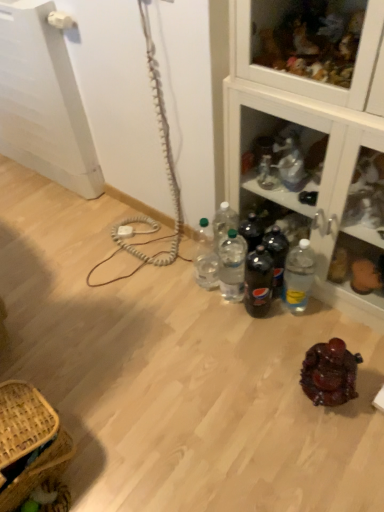
The image size is (384, 512). I want to click on vacant space in front of shiny brown candy at center, so (338, 446).